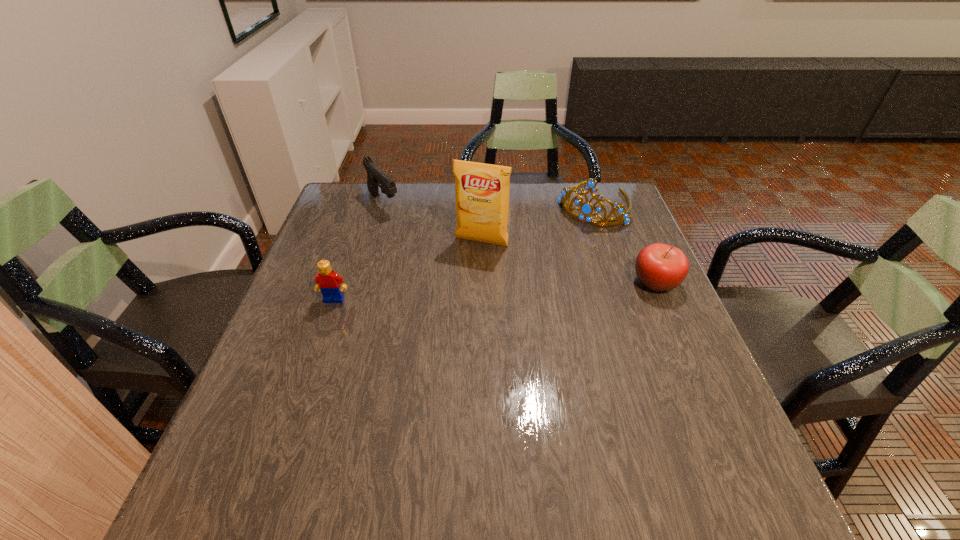
This screenshot has height=540, width=960. Find the location of `free space at the near right corner of the desktop`. free space at the near right corner of the desktop is located at coordinates (708, 447).

I want to click on vacant region between the third farthest object and the apple, so click(x=568, y=262).

Locate an element on the screen. The image size is (960, 540). free area in between the tiara and the tallest object is located at coordinates (538, 224).

This screenshot has height=540, width=960. Find the location of `vacant point located between the apple and the Lego`. vacant point located between the apple and the Lego is located at coordinates point(495,291).

Locate an element on the screen. free space between the third object from left to right and the tiara is located at coordinates (538, 224).

Locate an element on the screen. The height and width of the screenshot is (540, 960). vacant space that's between the third object from left to right and the apple is located at coordinates (568, 262).

The image size is (960, 540). What are the coordinates of `vacant space that's between the tiara and the Lego` in the screenshot? It's located at (464, 252).

You are a GUI agent. You are given a task and a screenshot of the screen. Output one action in this format:
    pyautogui.click(x=<x>, y=<y>)
    Task: Click on the free area in between the tiara and the Lego
    The image size is (960, 540).
    Given the screenshot: What is the action you would take?
    pyautogui.click(x=464, y=252)

Locate an element on the screen. Image resolution: width=960 pixels, height=540 pixels. object that ranks as the third closest to the pistol is located at coordinates (586, 209).

At what (x,y) coordinates should I click in order to perform the action: click on object that is the fourth closest to the apple. Please return your answer as a coordinate pair (x, y). This screenshot has width=960, height=540. Looking at the image, I should click on (327, 281).